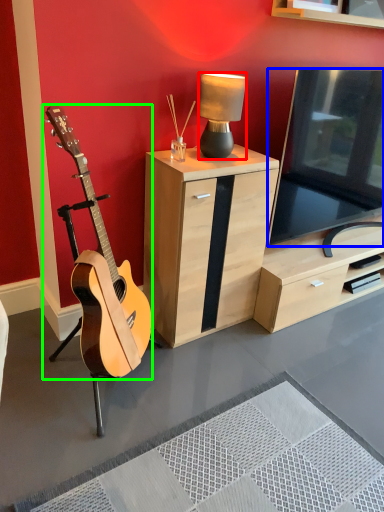
Question: Which object is the closest to the lamp (highlighted by a red box)? Choose among these: television (highlighted by a blue box) or guitar (highlighted by a green box).

Choices:
 (A) television
 (B) guitar

Answer: (A)